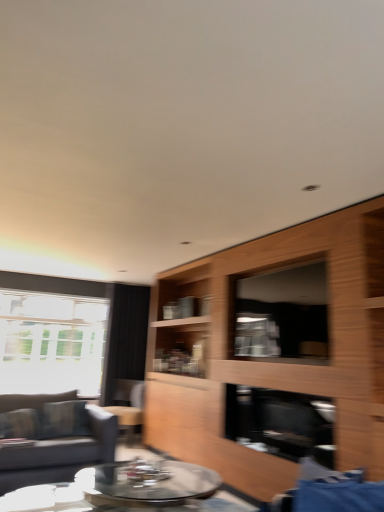
Question: Considering their positions, is wooden cabinet at center located in front of or behind transparent glass window screen at center?

Choices:
 (A) behind
 (B) front

Answer: (B)

Question: Is wooden cabinet at center wider or thinner than transparent glass window screen at center?

Choices:
 (A) wide
 (B) thin

Answer: (A)

Question: Which is nearer to the transparent glass window screen at center?

Choices:
 (A) wooden cabinet at center
 (B) blue fabric swivel chair at lower right
 (C) dark gray fabric couch at left
 (D) black fabric curtain at left
 (E) transparent glass window at left

Answer: (A)

Question: Estimate the real-world distances between objects in this image. Which object is closer to the dark gray fabric couch at left?

Choices:
 (A) clear glass coffee table at center
 (B) blue fabric swivel chair at lower right
 (C) wooden cabinet at center
 (D) black glass fireplace at center
 (E) transparent glass window at left

Answer: (A)